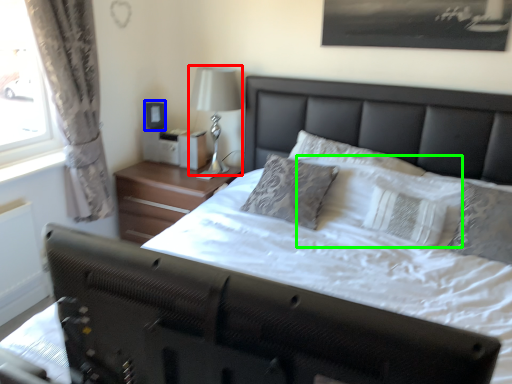
Question: Based on their relative distances, which object is farther from bedside lamp (highlighted by a red box)? Choose from picture frame (highlighted by a blue box) and pillow (highlighted by a green box).

Choices:
 (A) picture frame
 (B) pillow

Answer: (B)